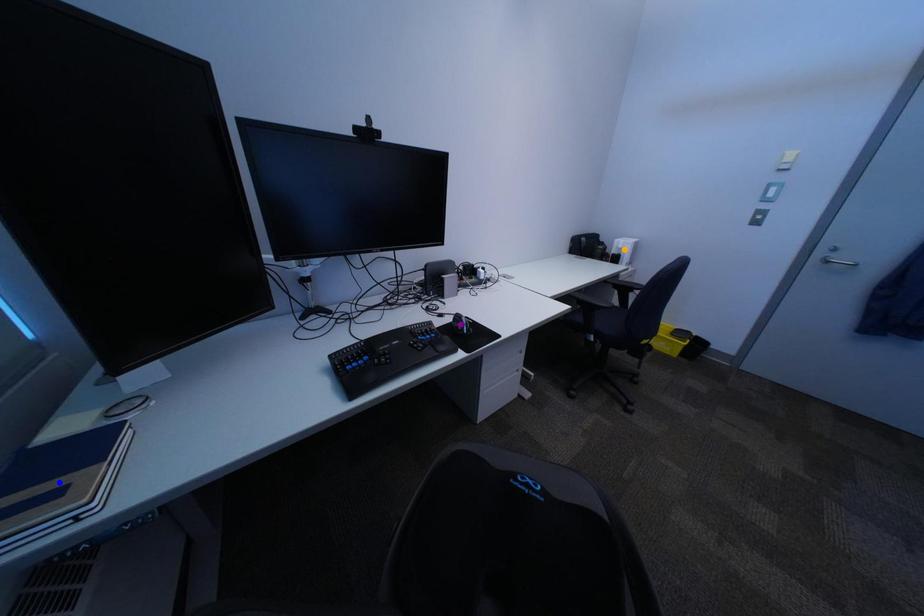
Order these from nearest to farthest:
1. orange point
2. purple point
3. blue point

blue point < purple point < orange point